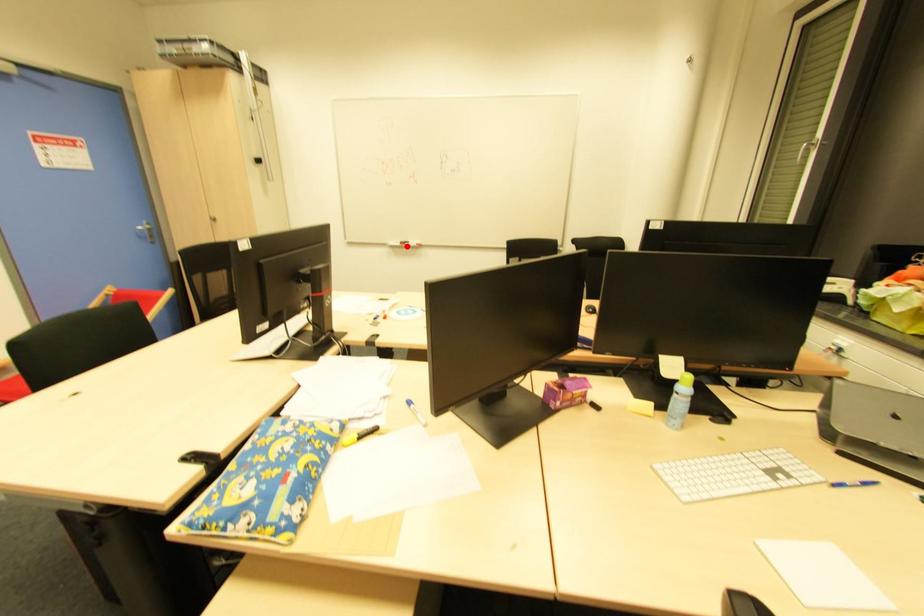
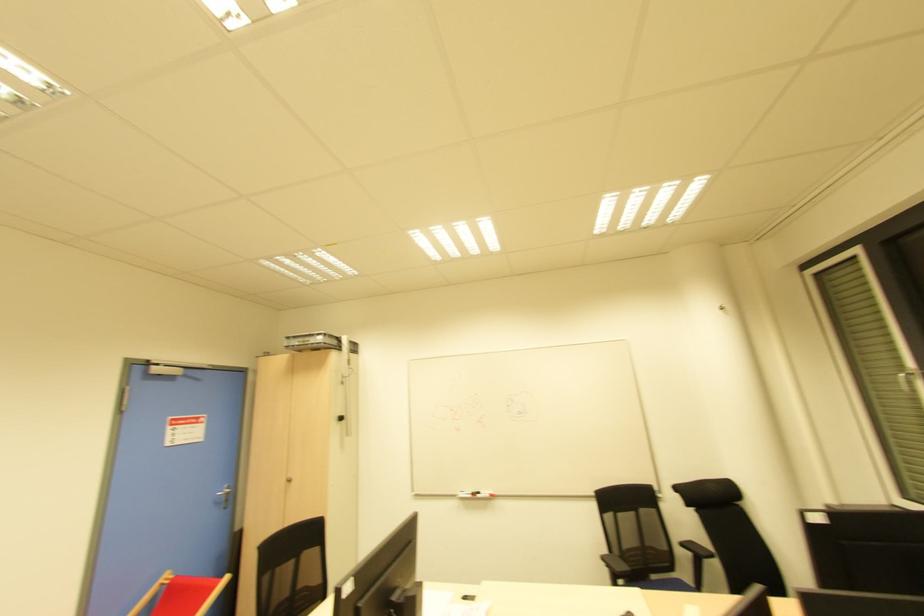
Locate, in the second image, the point that corresponds to the highlighted location in the first image.

(478, 496)